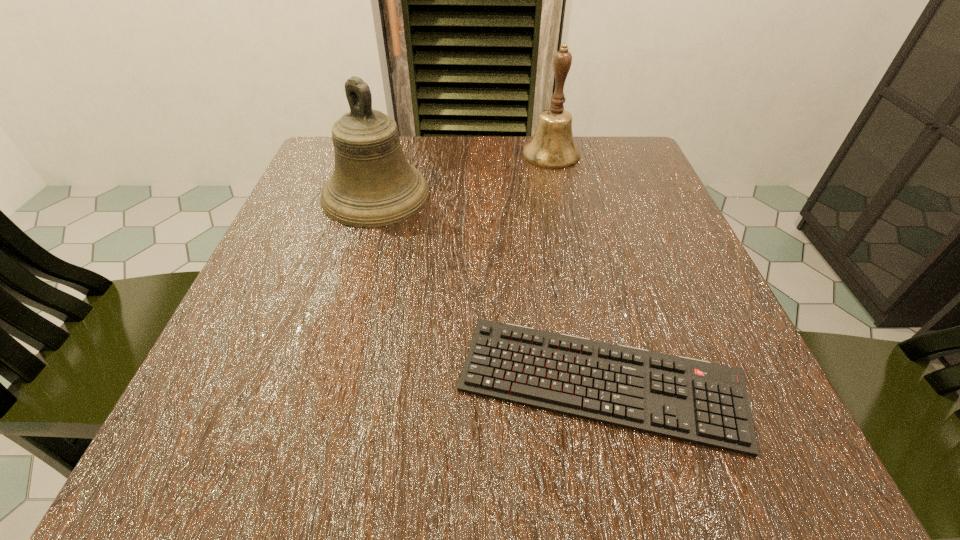
At what (x,y) coordinates should I click in order to perform the action: click on free point between the nearest object and the left bell. Please return your answer as a coordinate pair (x, y). This screenshot has height=540, width=960. Looking at the image, I should click on (489, 288).

Find the location of `free space that is in between the right bell and the nearest object`. free space that is in between the right bell and the nearest object is located at coordinates (576, 268).

Locate an element on the screen. This screenshot has width=960, height=540. unoccupied area between the shortest object and the right bell is located at coordinates pyautogui.click(x=576, y=268).

Where is `free space between the right bell and the shortest object`? The width and height of the screenshot is (960, 540). free space between the right bell and the shortest object is located at coordinates (576, 268).

Find the location of a particular element. The height and width of the screenshot is (540, 960). vacant area that lies between the nearest object and the leftmost object is located at coordinates (489, 288).

This screenshot has width=960, height=540. What are the coordinates of `unoccupied area between the left bell and the shortest object` in the screenshot? It's located at (489, 288).

This screenshot has width=960, height=540. Find the location of `vacant area that lies between the left bell and the right bell`. vacant area that lies between the left bell and the right bell is located at coordinates (464, 174).

At what (x,y) coordinates should I click in order to perform the action: click on vacant area between the right bell and the leftmost object. Please return your answer as a coordinate pair (x, y). The image size is (960, 540). Looking at the image, I should click on (464, 174).

At what (x,y) coordinates should I click in order to perform the action: click on free space between the leftmost object and the right bell. Please return your answer as a coordinate pair (x, y). The width and height of the screenshot is (960, 540). Looking at the image, I should click on (464, 174).

Identify which object is the second nearest to the leftmost object. Please provide its 2D coordinates. Your answer should be formatted as a tuple, i.e. [(x, y)], where the tuple contains the x and y coordinates of a point satisfying the conditions above.

[(691, 400)]